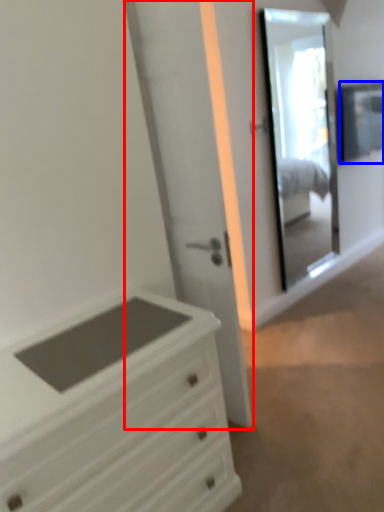
Question: Which object is closer to the camera taking this photo, door (highlighted by a red box) or window (highlighted by a blue box)?

Choices:
 (A) door
 (B) window

Answer: (A)